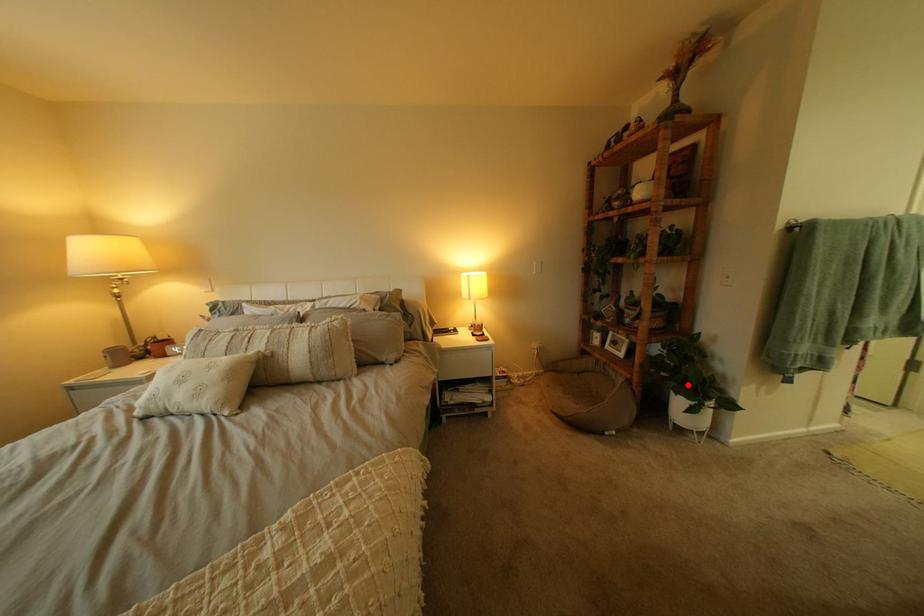
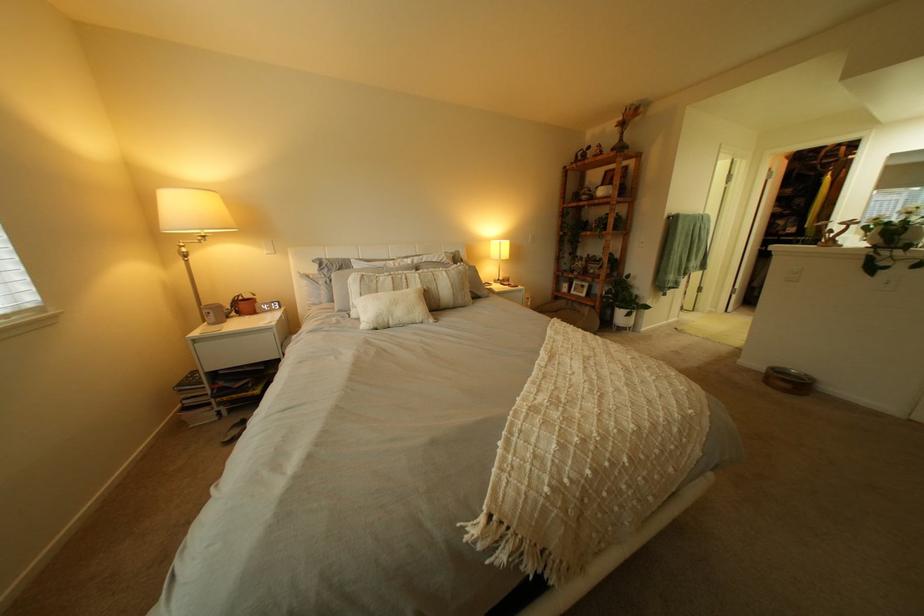
Question: I am providing you with two images of the same scene from different viewpoints. Given a red point in image1, look at the same physical point in image2. Is it:

Choices:
 (A) Closer to the viewpoint
 (B) Farther from the viewpoint

Answer: (A)